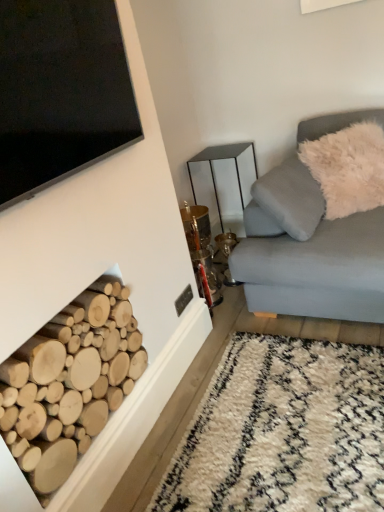
Where is `free space above white shaggy rug at lower right (from a real-world perspective)`? The height and width of the screenshot is (512, 384). free space above white shaggy rug at lower right (from a real-world perspective) is located at coordinates (278, 434).